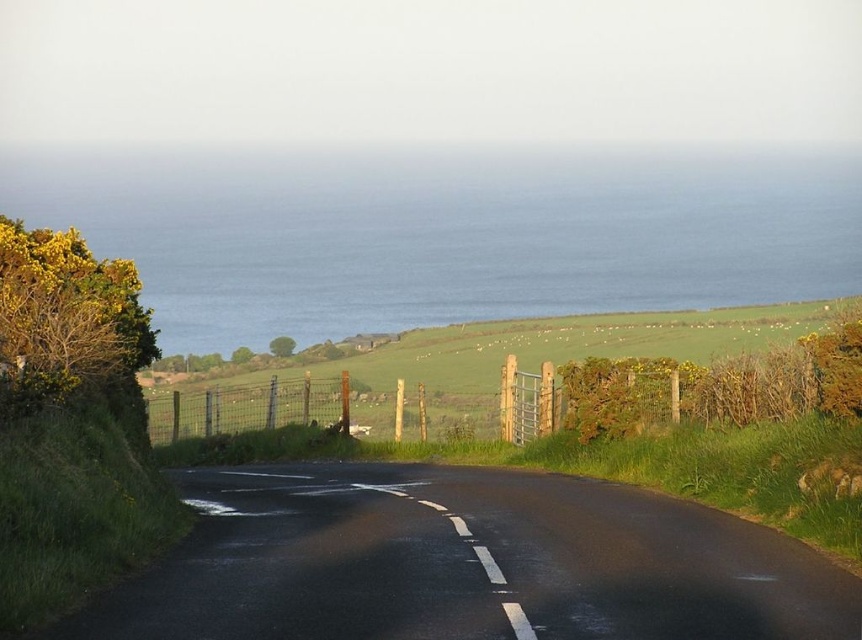
Question: In this image, where is blue water at upper center located relative to green grassy hillside at center?

Choices:
 (A) right
 (B) left

Answer: (B)

Question: Does blue water at upper center appear under green grassy hillside at center?

Choices:
 (A) no
 (B) yes

Answer: (A)

Question: Which object is farther from the camera taking this photo?

Choices:
 (A) green grassy hillside at center
 (B) blue water at upper center

Answer: (B)

Question: Considering the relative positions of blue water at upper center and green grassy hillside at center in the image provided, where is blue water at upper center located with respect to green grassy hillside at center?

Choices:
 (A) left
 (B) right

Answer: (A)

Question: Which point is farther to the camera?

Choices:
 (A) (176, 408)
 (B) (628, 284)

Answer: (B)